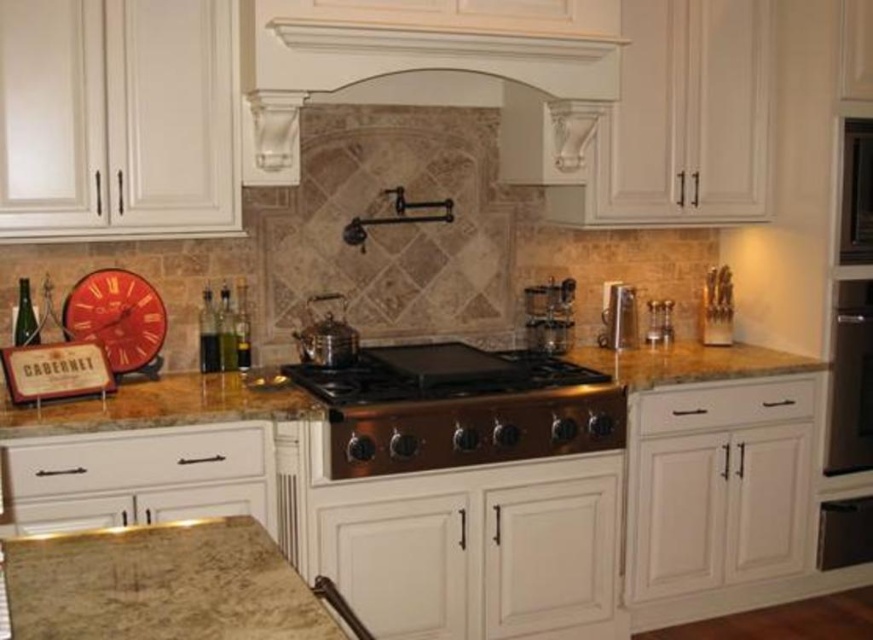
Does satin nickel oven at right appear on the right side of white matte drawer at center?

Indeed, satin nickel oven at right is positioned on the right side of white matte drawer at center.

Does point (870, 278) come closer to viewer compared to point (638, 435)?

No.

The image size is (873, 640). What are the coordinates of `satin nickel oven at right` in the screenshot? It's located at (850, 380).

Is point (129, 467) behind point (868, 211)?

No, it is not.

This screenshot has height=640, width=873. Find the location of `white matte drawer at lower left`. white matte drawer at lower left is located at coordinates (138, 460).

Which is behind, point (43, 483) or point (861, 243)?

The point (861, 243) is behind.

Where is `white matte drawer at lower left`? white matte drawer at lower left is located at coordinates (138, 460).

Does marble countertop at lower left have a lesser height compared to satin nickel faucet at center?

Indeed, marble countertop at lower left has a lesser height compared to satin nickel faucet at center.

Who is more distant from viewer, (x=230, y=552) or (x=636, y=332)?

The point (x=636, y=332) is behind.

Who is more distant from viewer, [201,636] or [636,321]?

The point [636,321] is more distant.

Identify the location of marble countertop at lower left. The image size is (873, 640). (162, 586).